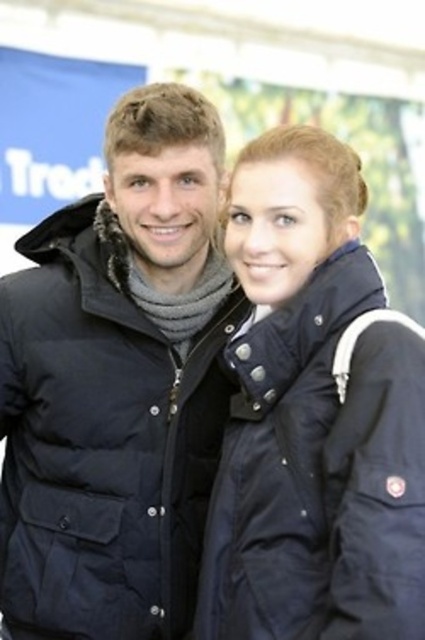
Question: Can you confirm if matte black jacket at center is positioned below navy blue down jacket at center?

Choices:
 (A) no
 (B) yes

Answer: (B)

Question: Is matte black jacket at center to the right of navy blue down jacket at center from the viewer's perspective?

Choices:
 (A) yes
 (B) no

Answer: (B)

Question: Which object appears farthest from the camera in this image?

Choices:
 (A) navy blue down jacket at center
 (B) matte black jacket at center

Answer: (A)

Question: Does matte black jacket at center have a larger size compared to navy blue down jacket at center?

Choices:
 (A) yes
 (B) no

Answer: (A)